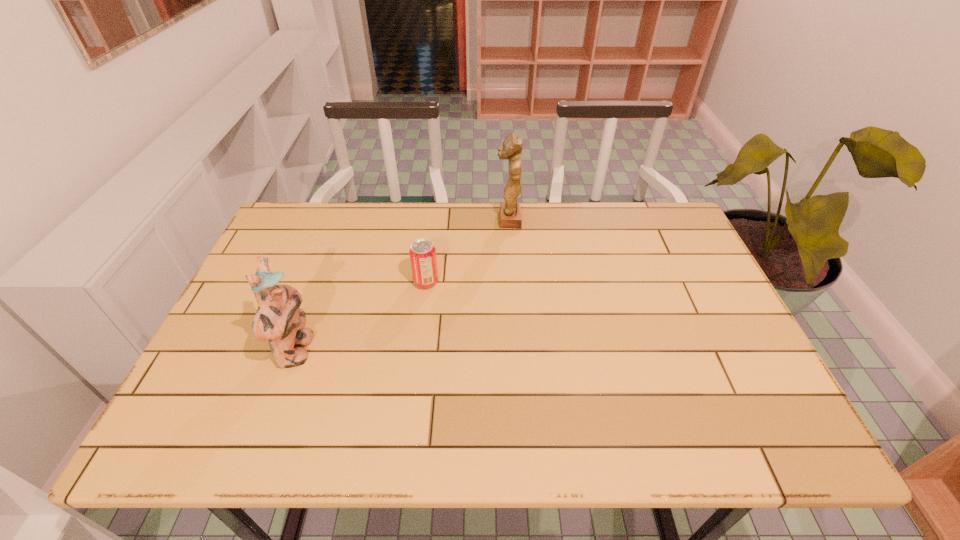
Find the location of a particular element. The image size is (960, 540). the farther figurine is located at coordinates (510, 212).

Locate an element on the screen. The height and width of the screenshot is (540, 960). the farthest object is located at coordinates (510, 212).

At what (x,y) coordinates should I click in order to perform the action: click on the nearer figurine. Please return your answer as a coordinate pair (x, y). Looking at the image, I should click on (279, 321).

Locate an element on the screen. This screenshot has width=960, height=540. the left figurine is located at coordinates (279, 321).

Locate an element on the screen. This screenshot has width=960, height=540. the second farthest object is located at coordinates (422, 253).

This screenshot has height=540, width=960. Find the location of `the shortest object`. the shortest object is located at coordinates (422, 253).

The height and width of the screenshot is (540, 960). Identify the location of vacant space located on the front-facing side of the farthest object. (386, 219).

The image size is (960, 540). I want to click on free spot located on the front-facing side of the farthest object, so click(465, 219).

Locate an element on the screen. The image size is (960, 540). free spot located 0.200m on the front-facing side of the farthest object is located at coordinates (433, 219).

Locate an element on the screen. This screenshot has width=960, height=540. blank space located on the front-facing side of the nearer figurine is located at coordinates (382, 352).